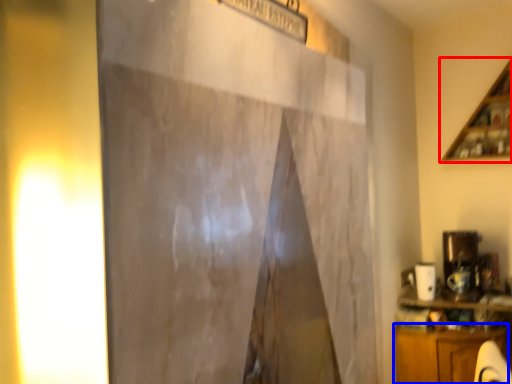
Question: Which of the following is the closest to the observer, shelf (highlighted by a red box) or cabinetry (highlighted by a blue box)?

Choices:
 (A) shelf
 (B) cabinetry

Answer: (B)